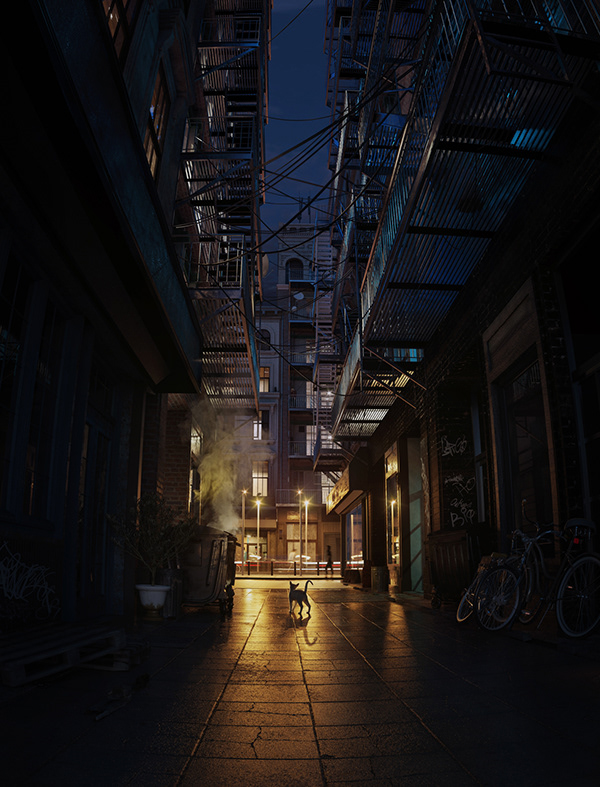
Locate an element on the screen. Image resolution: width=600 pixels, height=787 pixels. windows is located at coordinates (257, 482), (253, 422), (202, 441), (333, 478).